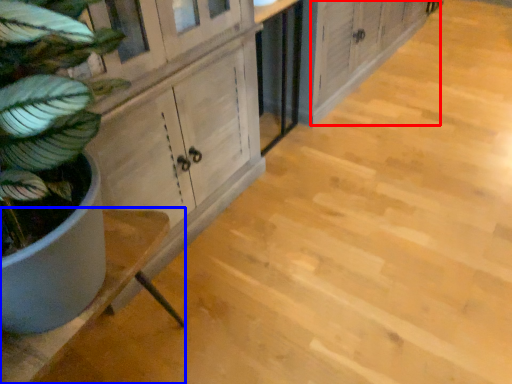
Question: Which of the following is the farthest to the observer, cabinetry (highlighted by a red box) or counter (highlighted by a blue box)?

Choices:
 (A) cabinetry
 (B) counter

Answer: (A)